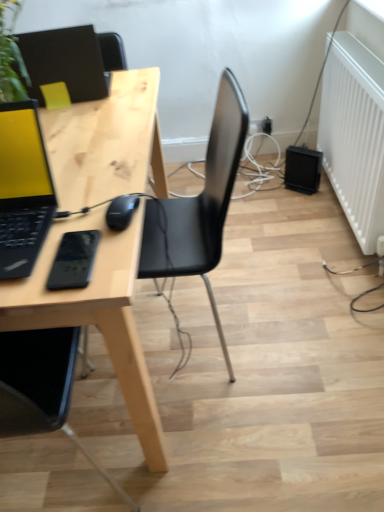
Image resolution: width=384 pixels, height=512 pixels. I want to click on free space on the front side of white matte radiator at right, so click(321, 301).